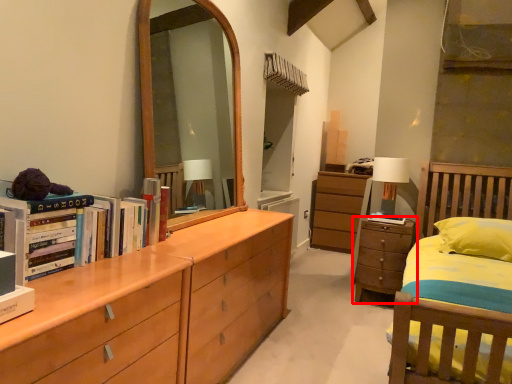
Question: From the image, what is the correct spatial relationship of chest of drawers (annotated by the red box) in relation to table lamp?

Choices:
 (A) left
 (B) right

Answer: (A)